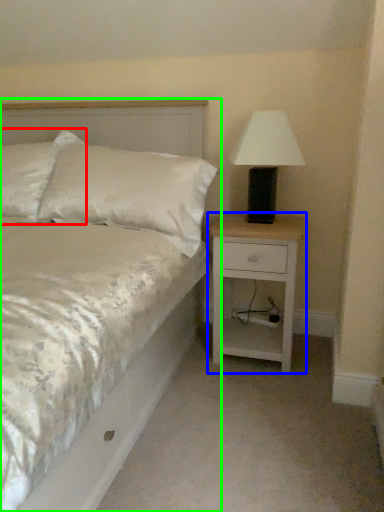
Question: Which object is the closest to the pillow (highlighted by a red box)? Choose among these: nightstand (highlighted by a blue box) or bed (highlighted by a green box).

Choices:
 (A) nightstand
 (B) bed

Answer: (B)